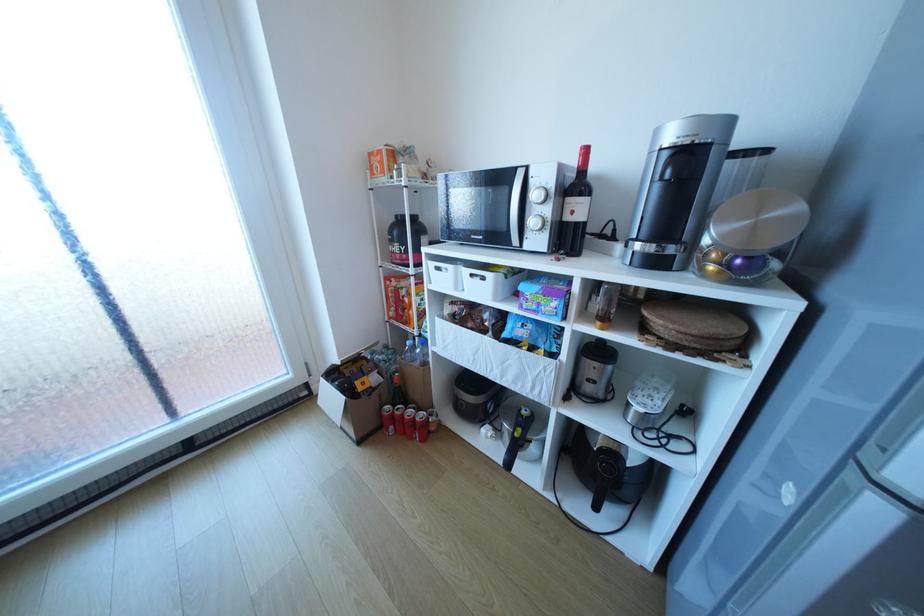
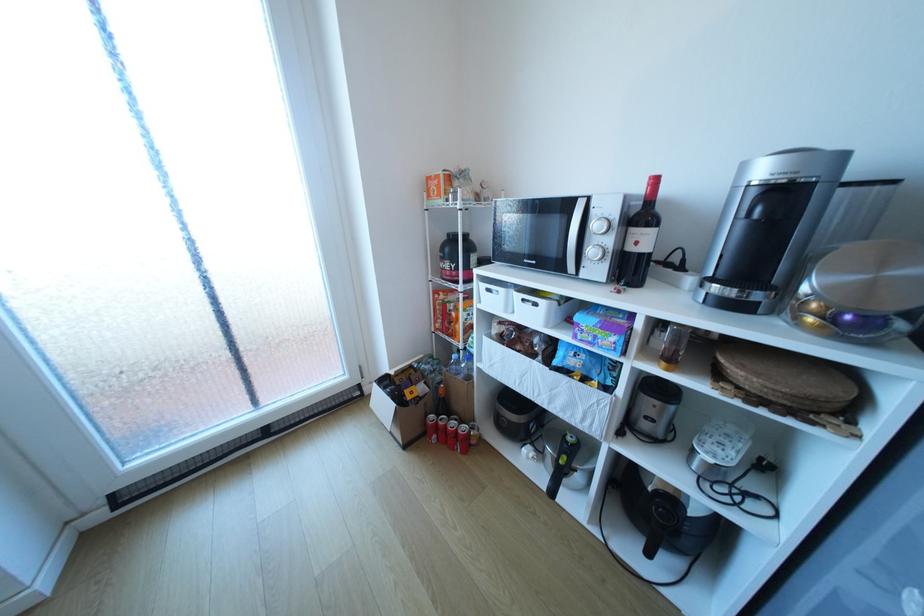
Question: The camera is either moving clockwise (left) or counter-clockwise (right) around the object. The first image is from the beginning of the video and the second image is from the end. Is the camera moving left or right when shooting the video?

Choices:
 (A) Left
 (B) Right

Answer: (B)